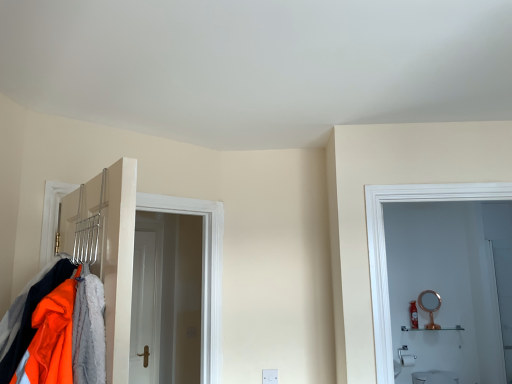
Describe the element at coordinates (430, 306) in the screenshot. I see `rose gold metallic mirror at right` at that location.

You are a GUI agent. You are given a task and a screenshot of the screen. Output one action in this format:
    pyautogui.click(x=<x>, y=<y>)
    Task: Click on the rose gold metallic mirror at right
    
    Given the screenshot: What is the action you would take?
    pyautogui.click(x=430, y=306)

Considering the sizes of white glossy shelf at right and metallic silver coat rack at left in the image, is white glossy shelf at right bigger or smaller than metallic silver coat rack at left?

white glossy shelf at right is smaller than metallic silver coat rack at left.

From a real-world perspective, is white glossy shelf at right physically located above or below metallic silver coat rack at left?

white glossy shelf at right is situated lower than metallic silver coat rack at left in the real world.

Based on the photo, can you see white glossy shelf at right touching metallic silver coat rack at left?

No, white glossy shelf at right is not touching metallic silver coat rack at left.

Which object is further away from the camera, white glossy shelf at right or metallic silver coat rack at left?

white glossy shelf at right is further away from the camera.

Consider the image. From a real-world perspective, which object rests below the other?

In real-world perspective, white glossy shelf at right is lower.

Does rose gold metallic mirror at right have a lesser width compared to white glossy shelf at right?

Indeed, rose gold metallic mirror at right has a lesser width compared to white glossy shelf at right.

Which is less distant, (431, 327) or (407, 329)?

The point (431, 327) is closer to the camera.

Is metallic silver coat rack at left next to rose gold metallic mirror at right?

No, metallic silver coat rack at left is not in contact with rose gold metallic mirror at right.

Looking at this image, how far apart are metallic silver coat rack at left and rose gold metallic mirror at right?

They are 3.34 meters apart.

Does metallic silver coat rack at left have a greater height compared to rose gold metallic mirror at right?

Indeed, metallic silver coat rack at left has a greater height compared to rose gold metallic mirror at right.

Is rose gold metallic mirror at right a part of metallic silver coat rack at left?

Definitely not — rose gold metallic mirror at right is not inside metallic silver coat rack at left.

Is rose gold metallic mirror at right in contact with metallic silver coat rack at left?

rose gold metallic mirror at right and metallic silver coat rack at left are clearly separated.

Could you tell me if rose gold metallic mirror at right is turned towards metallic silver coat rack at left?

No, rose gold metallic mirror at right does not turn towards metallic silver coat rack at left.

Is rose gold metallic mirror at right closer to the viewer compared to metallic silver coat rack at left?

No, it is not.

Between metallic silver coat rack at left and white glossy shelf at right, which one has larger width?

Wider between the two is metallic silver coat rack at left.

Considering the positions of objects metallic silver coat rack at left and white glossy shelf at right in the image provided, who is behind, metallic silver coat rack at left or white glossy shelf at right?

white glossy shelf at right is more distant.

Locate an element on the screen. The width and height of the screenshot is (512, 384). shelf on the right of metallic silver coat rack at left is located at coordinates (434, 329).

Which object is closer to the camera taking this photo, white glossy shelf at right or rose gold metallic mirror at right?

white glossy shelf at right is closer to the camera.

From the image's perspective, is white glossy shelf at right above rose gold metallic mirror at right?

Incorrect, from the image's perspective, white glossy shelf at right is lower than rose gold metallic mirror at right.

Is white glossy shelf at right beside rose gold metallic mirror at right?

There is a gap between white glossy shelf at right and rose gold metallic mirror at right.

Locate an element on the screen. shelf that is under the metallic silver coat rack at left (from a real-world perspective) is located at coordinates (434, 329).

Where is `mirror above the white glossy shelf at right (from a real-world perspective)`? Image resolution: width=512 pixels, height=384 pixels. mirror above the white glossy shelf at right (from a real-world perspective) is located at coordinates (430, 306).

From the image, which object appears to be farther from metallic silver coat rack at left, rose gold metallic mirror at right or white glossy shelf at right?

rose gold metallic mirror at right lies further to metallic silver coat rack at left than the other object.

From the image, which object appears to be farther from white glossy shelf at right, metallic silver coat rack at left or rose gold metallic mirror at right?

metallic silver coat rack at left lies further to white glossy shelf at right than the other object.

Estimate the real-world distances between objects in this image. Which object is closer to rose gold metallic mirror at right, metallic silver coat rack at left or white glossy shelf at right?

The object closer to rose gold metallic mirror at right is white glossy shelf at right.

When comparing their distances from metallic silver coat rack at left, does white glossy shelf at right or rose gold metallic mirror at right seem further?

rose gold metallic mirror at right is positioned further to the anchor metallic silver coat rack at left.

Based on the photo, looking at the image, which one is located closer to rose gold metallic mirror at right, white glossy shelf at right or metallic silver coat rack at left?

Among the two, white glossy shelf at right is located nearer to rose gold metallic mirror at right.

Which object lies further to the anchor point white glossy shelf at right, rose gold metallic mirror at right or metallic silver coat rack at left?

metallic silver coat rack at left is positioned further to the anchor white glossy shelf at right.

Find the location of a particular element. This screenshot has height=384, width=512. shelf between metallic silver coat rack at left and rose gold metallic mirror at right in the front-back direction is located at coordinates (434, 329).